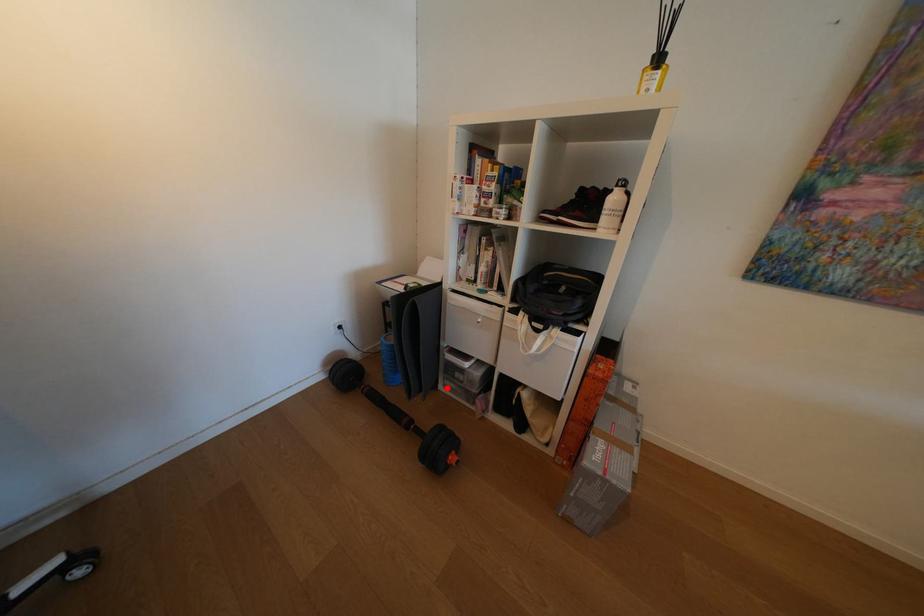
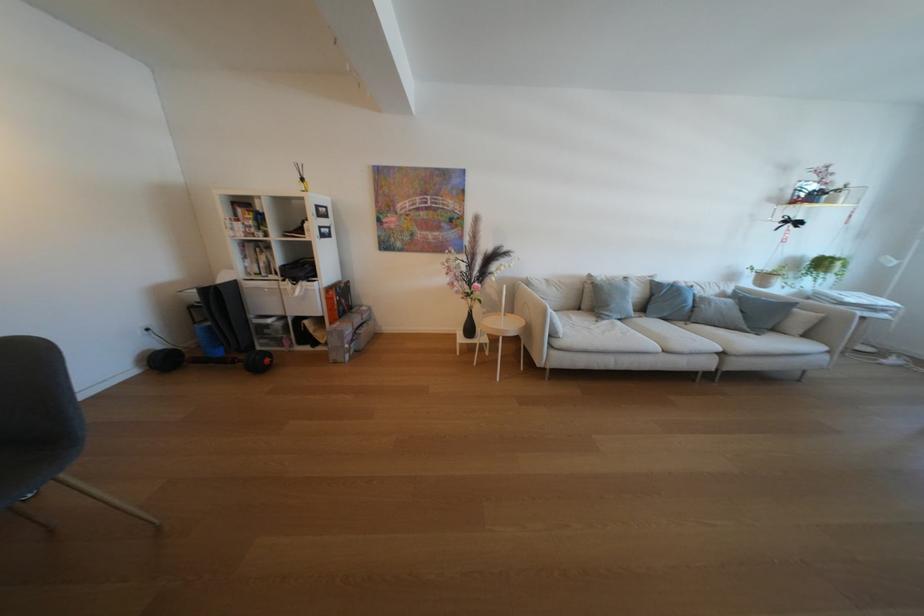
Question: A red point is marked in image1. In image2, is the corresponding 3D point closer to the camera or farther? Reply with the corresponding letter.

Choices:
 (A) The corresponding 3D point is closer.
 (B) The corresponding 3D point is farther.

Answer: (A)